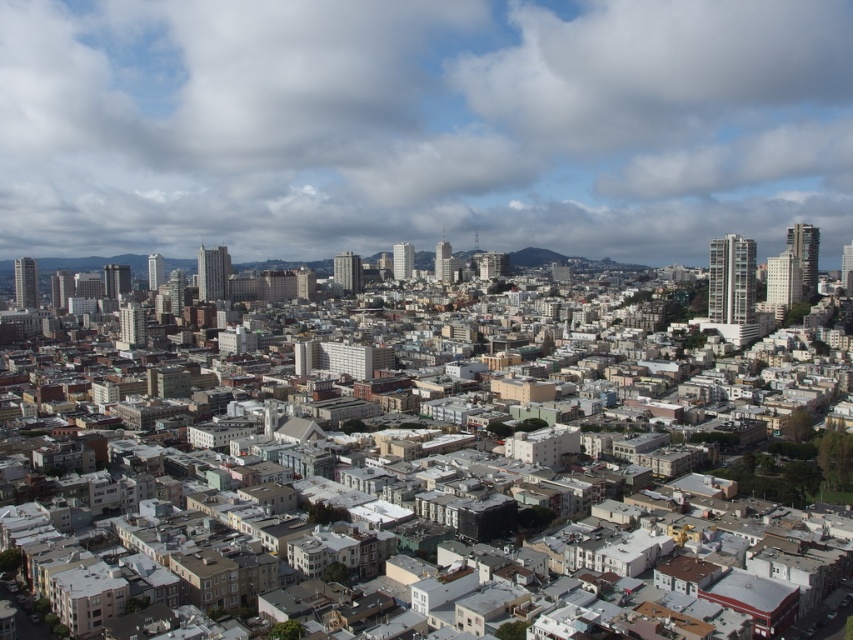
You are a drone operator tasked with capturing aerial footage of the city. Your drone is currently at a point 661.80 meters away from you. Can you confirm if the drone is positioned at point (846,26) in the image?

Yes, the point (846,26) is 661.80 meters away from the viewer, so the drone is positioned at that point.

Looking at the cityscape from above, you notice a white fluffy cloud at upper center and a green grassy hillside at center. Which of these two objects is positioned to the left when viewed from the observer perspective?

The white fluffy cloud at upper center is positioned to the left of the green grassy hillside at center.